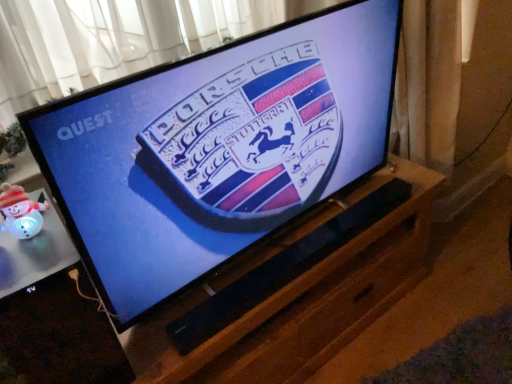
Question: Is black glossy tv at center shorter than white glossy snowman at lower left?

Choices:
 (A) yes
 (B) no

Answer: (B)

Question: Does black glossy tv at center have a greater height compared to white glossy snowman at lower left?

Choices:
 (A) yes
 (B) no

Answer: (A)

Question: Could you tell me if black glossy tv at center is facing white glossy snowman at lower left?

Choices:
 (A) yes
 (B) no

Answer: (B)

Question: Considering the relative positions of black glossy tv at center and white glossy snowman at lower left in the image provided, is black glossy tv at center to the left of white glossy snowman at lower left from the viewer's perspective?

Choices:
 (A) no
 (B) yes

Answer: (A)

Question: Would you say black glossy tv at center is outside white glossy snowman at lower left?

Choices:
 (A) no
 (B) yes

Answer: (B)

Question: Is black glossy tv at center closer to camera compared to white glossy snowman at lower left?

Choices:
 (A) yes
 (B) no

Answer: (B)

Question: Considering the relative positions of black matte speaker at center and black glossy tv at center in the image provided, is black matte speaker at center to the right of black glossy tv at center from the viewer's perspective?

Choices:
 (A) no
 (B) yes

Answer: (B)

Question: Is black matte speaker at center positioned in front of black glossy tv at center?

Choices:
 (A) yes
 (B) no

Answer: (B)

Question: From a real-world perspective, is black matte speaker at center below black glossy tv at center?

Choices:
 (A) yes
 (B) no

Answer: (A)

Question: Is black matte speaker at center with black glossy tv at center?

Choices:
 (A) yes
 (B) no

Answer: (B)

Question: From a real-world perspective, does black matte speaker at center stand above black glossy tv at center?

Choices:
 (A) no
 (B) yes

Answer: (A)

Question: Can you confirm if black matte speaker at center is bigger than black glossy tv at center?

Choices:
 (A) no
 (B) yes

Answer: (A)

Question: Are black glossy tv at center and black matte speaker at center far apart?

Choices:
 (A) yes
 (B) no

Answer: (B)